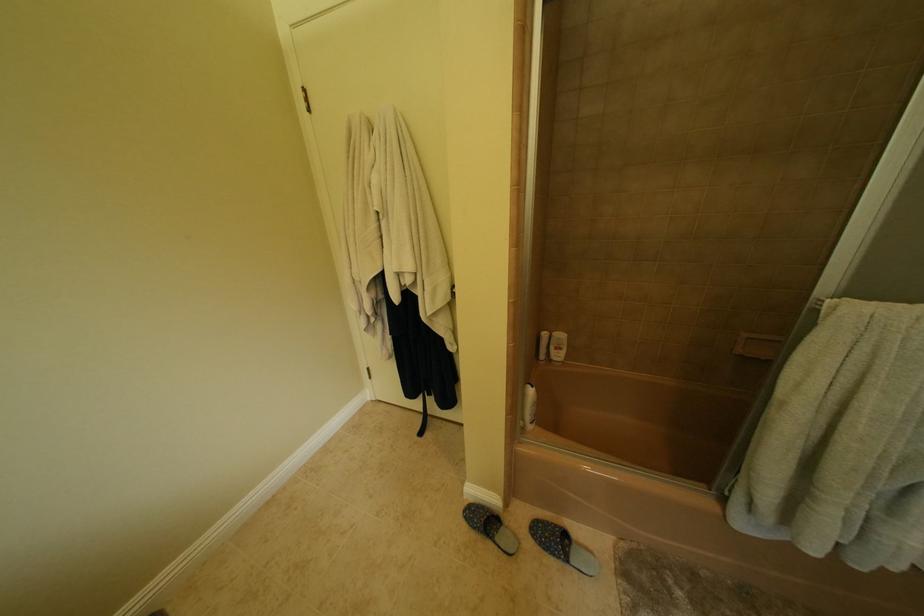
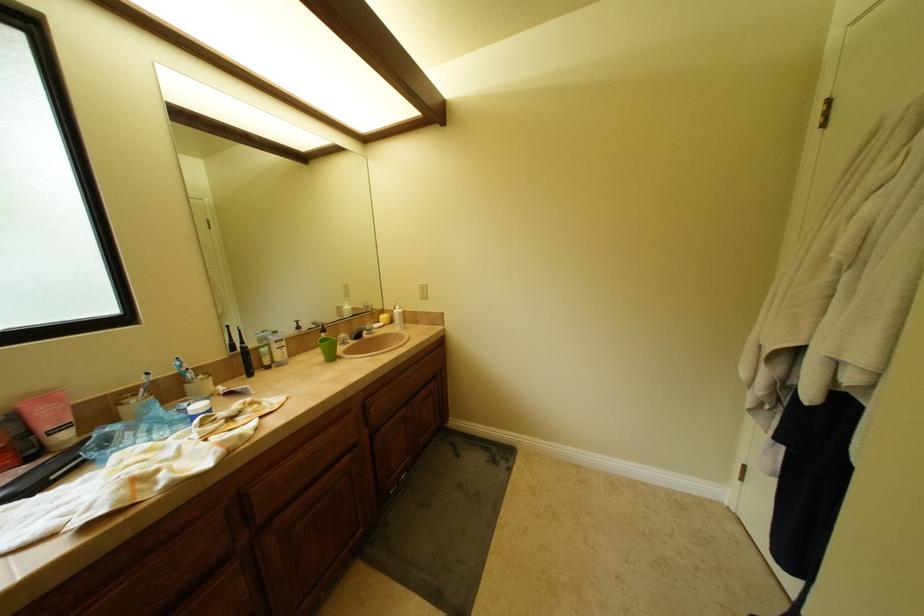
Question: How did the camera likely rotate?

Choices:
 (A) Left
 (B) Right
 (C) Up
 (D) Down

Answer: (A)